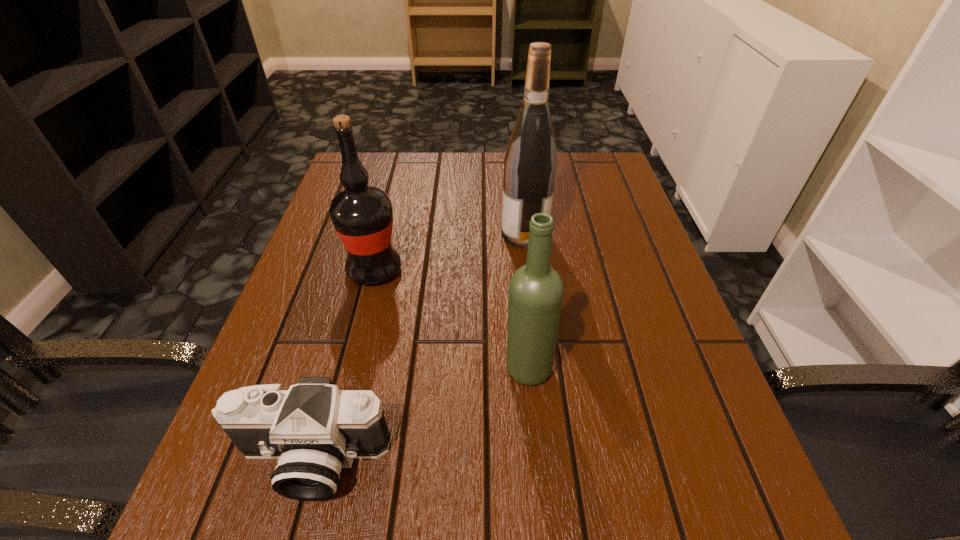
The image size is (960, 540). I want to click on the farthest wine bottle, so click(530, 163).

This screenshot has width=960, height=540. I want to click on the tallest wine bottle, so click(x=530, y=163).

I want to click on the leftmost wine bottle, so click(x=362, y=215).

At what (x,y) coordinates should I click in order to perform the action: click on the second farthest object. Please return your answer as a coordinate pair (x, y). Looking at the image, I should click on (362, 215).

The width and height of the screenshot is (960, 540). Find the location of `the third farthest object`. the third farthest object is located at coordinates 536,290.

The width and height of the screenshot is (960, 540). Find the location of `the nearest object`. the nearest object is located at coordinates (314, 429).

Locate an element on the screen. This screenshot has height=540, width=960. camera is located at coordinates (314, 429).

Locate an element on the screen. The image size is (960, 540). free space located on the right of the farthest wine bottle is located at coordinates pos(625,233).

I want to click on vacant space situated 0.100m on the front of the leftmost wine bottle, so click(x=360, y=328).

Locate an element on the screen. The width and height of the screenshot is (960, 540). vacant area located on the front of the nearest wine bottle is located at coordinates point(542,528).